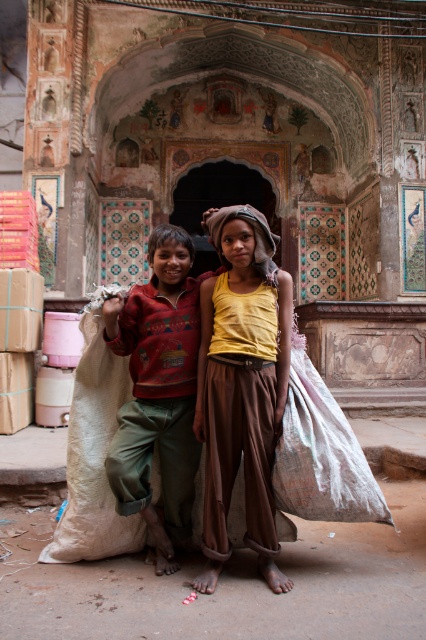
Question: Is yellow cotton shirt at center below red sweater at center?

Choices:
 (A) no
 (B) yes

Answer: (A)

Question: Which point is closer to the camera taking this photo?

Choices:
 (A) (222, 278)
 (B) (150, 356)

Answer: (B)

Question: In this image, where is yellow cotton shirt at center located relative to red sweater at center?

Choices:
 (A) left
 (B) right

Answer: (B)

Question: Observing the image, what is the correct spatial positioning of yellow cotton shirt at center in reference to red sweater at center?

Choices:
 (A) right
 (B) left

Answer: (A)

Question: Which point is farther to the camera?

Choices:
 (A) (230, 244)
 (B) (187, 248)

Answer: (B)